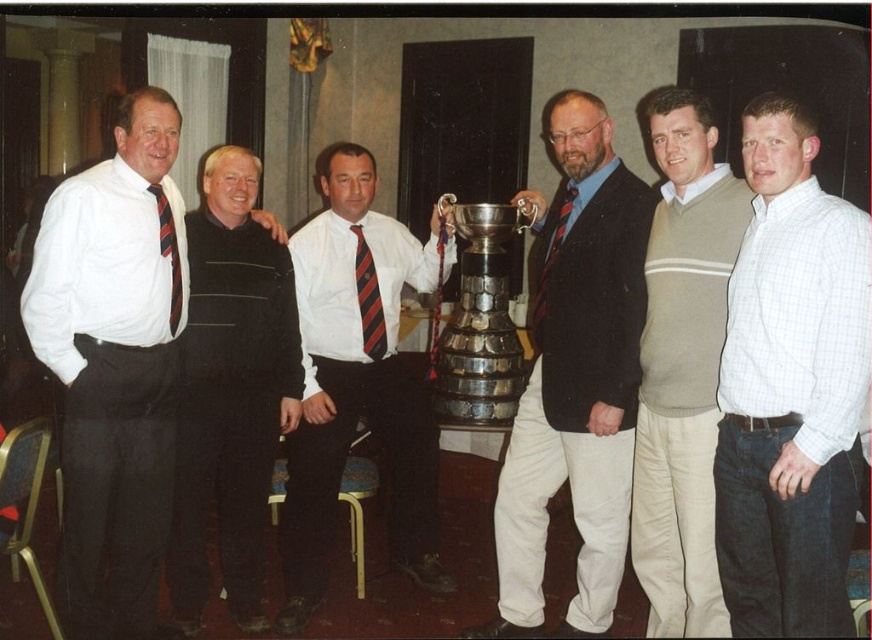
Looking at this image, who is more forward, (x=87, y=324) or (x=514, y=385)?

Point (x=87, y=324) is more forward.

Locate an element on the screen. This screenshot has width=872, height=640. white shirt at left is located at coordinates (112, 368).

Consider the image. Is white shirt at left to the left of shiny silver trophy at center from the viewer's perspective?

Yes, white shirt at left is to the left of shiny silver trophy at center.

Does point (58, 289) come in front of point (516, 506)?

That is True.

Between point (172, 484) and point (528, 596), which one is positioned behind?

The point (528, 596) is behind.

Find the location of a particular element. The image size is (872, 640). white shirt at left is located at coordinates (112, 368).

Between white shirt at left and light brown sweater at center, which one is positioned lower?

Result: light brown sweater at center is lower down.

Between point (126, 136) and point (665, 333), which one is positioned behind?

Positioned behind is point (665, 333).

Find the location of a particular element. The image size is (872, 640). white shirt at left is located at coordinates (112, 368).